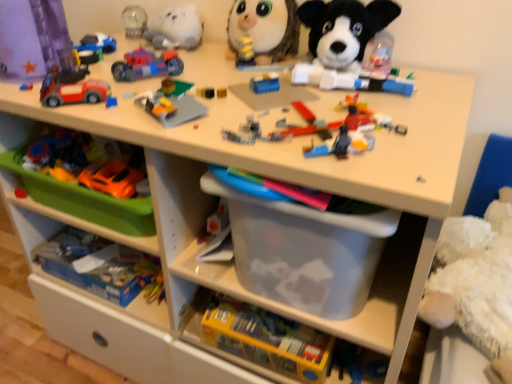
Locate an element on the screen. The width and height of the screenshot is (512, 384). translucent plastic bricks at center, which is counted as the fourth toy, starting from the bottom is located at coordinates (323, 123).

In order to click on orange matte car at left, which appears as the 3th toy when ordered from the bottom in this screenshot , I will do `click(111, 178)`.

Where is `matte plastic toy car at upper left, the eighth toy when ordered from bottom to top`? The width and height of the screenshot is (512, 384). matte plastic toy car at upper left, the eighth toy when ordered from bottom to top is located at coordinates (95, 47).

What do you see at coordinates (95, 47) in the screenshot? This screenshot has height=384, width=512. I see `matte plastic toy car at upper left, the second toy from the top` at bounding box center [95, 47].

The height and width of the screenshot is (384, 512). Describe the element at coordinates (295, 138) in the screenshot. I see `transparent plastic storage bin at center` at that location.

What are the coordinates of `transparent plastic storage bin at center` in the screenshot? It's located at (295, 138).

Locate an element on the screen. Image resolution: width=512 pixels, height=384 pixels. translucent plastic bricks at center, arranged as the 6th toy when viewed from the top is located at coordinates (323, 123).

Is yellow striped plush at upper center, marked as the first toy in a top-to-bottom arrangement, wider or thinner than translucent plastic container at lower center, which ranks as the 1th toy in bottom-to-top order?

In the image, yellow striped plush at upper center, marked as the first toy in a top-to-bottom arrangement, appears to be more narrow than translucent plastic container at lower center, which ranks as the 1th toy in bottom-to-top order.

Which is farther, (294, 35) or (196, 319)?

The point (294, 35) is behind.

The width and height of the screenshot is (512, 384). What are the coordinates of `the 8th toy above the translucent plastic container at lower center, positioned as the ninth toy in top-to-bottom order (from the image's perspective)` in the screenshot? It's located at click(x=264, y=29).

Considering the positions of objects yellow striped plush at upper center, marked as the first toy in a top-to-bottom arrangement, and translucent plastic container at lower center, positioned as the ninth toy in top-to-bottom order, in the image provided, who is in front, yellow striped plush at upper center, marked as the first toy in a top-to-bottom arrangement, or translucent plastic container at lower center, positioned as the ninth toy in top-to-bottom order,?

translucent plastic container at lower center, positioned as the ninth toy in top-to-bottom order.

This screenshot has height=384, width=512. In order to click on the 5th toy positioned above the transparent plastic storage bin at center (from the image's perspective) in this screenshot , I will do `click(344, 42)`.

Is transparent plastic storage bin at center positioned with its back to soft plush dog at upper center, which is the 3th toy in top-to-bottom order?

transparent plastic storage bin at center does not have its back to soft plush dog at upper center, which is the 3th toy in top-to-bottom order.

Is transparent plastic storage bin at center far from soft plush dog at upper center, which is the seventh toy from bottom to top?

transparent plastic storage bin at center is actually quite close to soft plush dog at upper center, which is the seventh toy from bottom to top.

Considering the positions of points (116, 94) and (325, 35), is point (116, 94) farther from camera compared to point (325, 35)?

No, (116, 94) is closer to viewer.

You are a GUI agent. You are given a task and a screenshot of the screen. Output one action in this format:
    pyautogui.click(x=<x>, y=<y>)
    Task: Click on the changing table below the matte plastic car at upper left, positioned as the 5th toy in bottom-to-top order (from the image's perspective)
    
    Given the screenshot: What is the action you would take?
    pyautogui.click(x=295, y=138)

In the image, is matte plastic car at upper left, positioned as the 5th toy in bottom-to-top order, positioned in front of or behind transparent plastic storage bin at center?

In the image, matte plastic car at upper left, positioned as the 5th toy in bottom-to-top order, appears behind transparent plastic storage bin at center.

Is matte plastic car at upper left, which is the fifth toy from top to bottom, far away from transparent plastic storage bin at center?

No, matte plastic car at upper left, which is the fifth toy from top to bottom, is not far away from transparent plastic storage bin at center.

Considering the sizes of matte plastic car at upper left, positioned as the 5th toy in bottom-to-top order, and transparent plastic storage bin at center in the image, is matte plastic car at upper left, positioned as the 5th toy in bottom-to-top order, taller or shorter than transparent plastic storage bin at center?

Considering their sizes, matte plastic car at upper left, positioned as the 5th toy in bottom-to-top order, has less height than transparent plastic storage bin at center.

Is translucent plastic motorcycle at upper center, placed as the fourth toy when sorted from top to bottom, not close to translucent plastic bricks at center, which is counted as the fourth toy, starting from the bottom?

No, translucent plastic motorcycle at upper center, placed as the fourth toy when sorted from top to bottom, is not far away from translucent plastic bricks at center, which is counted as the fourth toy, starting from the bottom.

Which of these two, translucent plastic motorcycle at upper center, placed as the fourth toy when sorted from top to bottom, or translucent plastic bricks at center, arranged as the 6th toy when viewed from the top, is wider?

With larger width is translucent plastic bricks at center, arranged as the 6th toy when viewed from the top.

In the scene shown: Is translucent plastic motorcycle at upper center, which ranks as the 6th toy in bottom-to-top order, aimed at translucent plastic bricks at center, which is counted as the fourth toy, starting from the bottom?

No, translucent plastic motorcycle at upper center, which ranks as the 6th toy in bottom-to-top order, is not oriented towards translucent plastic bricks at center, which is counted as the fourth toy, starting from the bottom.

Which of these two, translucent plastic motorcycle at upper center, placed as the fourth toy when sorted from top to bottom, or translucent plastic bricks at center, which is counted as the fourth toy, starting from the bottom, is bigger?

Bigger between the two is translucent plastic bricks at center, which is counted as the fourth toy, starting from the bottom.

From the picture: Relative to translucent plastic motorcycle at upper center, which ranks as the 6th toy in bottom-to-top order, is translucent plastic bricks at center, which is counted as the fourth toy, starting from the bottom, in front or behind?

Clearly, translucent plastic bricks at center, which is counted as the fourth toy, starting from the bottom, is in front of translucent plastic motorcycle at upper center, which ranks as the 6th toy in bottom-to-top order.

Considering the sizes of objects translucent plastic bricks at center, which is counted as the fourth toy, starting from the bottom, and translucent plastic motorcycle at upper center, which ranks as the 6th toy in bottom-to-top order, in the image provided, who is wider, translucent plastic bricks at center, which is counted as the fourth toy, starting from the bottom, or translucent plastic motorcycle at upper center, which ranks as the 6th toy in bottom-to-top order,?

translucent plastic bricks at center, which is counted as the fourth toy, starting from the bottom.

Based on the photo, would you say translucent plastic bricks at center, arranged as the 6th toy when viewed from the top, is inside or outside translucent plastic motorcycle at upper center, placed as the fourth toy when sorted from top to bottom?

translucent plastic bricks at center, arranged as the 6th toy when viewed from the top, is not enclosed by translucent plastic motorcycle at upper center, placed as the fourth toy when sorted from top to bottom.

From the image's perspective, is translucent plastic bricks at center, which is counted as the fourth toy, starting from the bottom, under translucent plastic motorcycle at upper center, placed as the fourth toy when sorted from top to bottom?

Indeed, from the image's perspective, translucent plastic bricks at center, which is counted as the fourth toy, starting from the bottom, is shown beneath translucent plastic motorcycle at upper center, placed as the fourth toy when sorted from top to bottom.

Visually, is blue cardboard box at lower left, arranged as the 2th toy when ordered from the bottom, positioned to the left or to the right of transparent plastic storage box at center?

From the image, it's evident that blue cardboard box at lower left, arranged as the 2th toy when ordered from the bottom, is to the left of transparent plastic storage box at center.

Does point (85, 263) appear closer or farther from the camera than point (292, 223)?

Point (85, 263).

From the transparent plastic storage box at center, count 7th toys backward and point to it. Please provide its 2D coordinates.

[(101, 266)]

In the scene shown: From a real-world perspective, which is physically below, blue cardboard box at lower left, marked as the 8th toy in a top-to-bottom arrangement, or transparent plastic storage box at center?

blue cardboard box at lower left, marked as the 8th toy in a top-to-bottom arrangement.

What's the angular difference between transparent plastic storage bin at center and green plastic tray at lower left's facing directions?

The angular difference between transparent plastic storage bin at center and green plastic tray at lower left is 0.459 degrees.

Is transparent plastic storage bin at center in front of or behind green plastic tray at lower left in the image?

In the image, transparent plastic storage bin at center appears in front of green plastic tray at lower left.

From the image's perspective, is transparent plastic storage bin at center below green plastic tray at lower left?

Yes, from the image's perspective, transparent plastic storage bin at center is below green plastic tray at lower left.

You are a GUI agent. You are given a task and a screenshot of the screen. Output one action in this format:
    pyautogui.click(x=<x>, y=<y>)
    Task: Click on the toy that is the 1st object to the left of the translucent plastic container at lower center, positioned as the ninth toy in top-to-bottom order, starting at the anchor
    The height and width of the screenshot is (384, 512).
    Given the screenshot: What is the action you would take?
    pyautogui.click(x=264, y=29)

The width and height of the screenshot is (512, 384). What are the coordinates of `changing table below the soft plush dog at upper center, which is the seventh toy from bottom to top (from the image's perspective)` in the screenshot? It's located at (295, 138).

Which object lies nearer to the anchor point translucent plastic bricks at center, arranged as the 6th toy when viewed from the top, translucent plastic container at lower center, positioned as the ninth toy in top-to-bottom order, or matte plastic toy car at upper left, the eighth toy when ordered from bottom to top?

translucent plastic container at lower center, positioned as the ninth toy in top-to-bottom order.

Looking at the image, which one is located closer to orange matte car at left, acting as the seventh toy starting from the top, soft plush dog at upper center, which is the 3th toy in top-to-bottom order, or matte plastic toy car at upper left, the eighth toy when ordered from bottom to top?

matte plastic toy car at upper left, the eighth toy when ordered from bottom to top, is positioned closer to the anchor orange matte car at left, acting as the seventh toy starting from the top.

Looking at the image, which one is located closer to transparent plastic storage box at center, translucent plastic bricks at center, which is counted as the fourth toy, starting from the bottom, or green plastic tray at lower left?

translucent plastic bricks at center, which is counted as the fourth toy, starting from the bottom, is positioned closer to the anchor transparent plastic storage box at center.

Based on their spatial positions, is matte plastic toy car at upper left, the eighth toy when ordered from bottom to top, or translucent plastic motorcycle at upper center, placed as the fourth toy when sorted from top to bottom, further from matte plastic car at upper left, which is the fifth toy from top to bottom?

matte plastic toy car at upper left, the eighth toy when ordered from bottom to top, is positioned further to the anchor matte plastic car at upper left, which is the fifth toy from top to bottom.

Which object lies further to the anchor point translucent plastic bricks at center, arranged as the 6th toy when viewed from the top, yellow striped plush at upper center, marked as the first toy in a top-to-bottom arrangement, or blue cardboard box at lower left, arranged as the 2th toy when ordered from the bottom?

blue cardboard box at lower left, arranged as the 2th toy when ordered from the bottom.

Which object lies nearer to the anchor point translucent plastic container at lower center, which ranks as the 1th toy in bottom-to-top order, green plastic tray at lower left or translucent plastic bricks at center, which is counted as the fourth toy, starting from the bottom?

The object closer to translucent plastic container at lower center, which ranks as the 1th toy in bottom-to-top order, is green plastic tray at lower left.

Which object lies nearer to the anchor point matte plastic toy car at upper left, the second toy from the top, green plastic tray at lower left or transparent plastic storage bin at center?

The object closer to matte plastic toy car at upper left, the second toy from the top, is green plastic tray at lower left.

From the image, which object appears to be nearer to soft plush dog at upper center, which is the seventh toy from bottom to top, green plastic tray at lower left or transparent plastic storage box at center?

Among the two, transparent plastic storage box at center is located nearer to soft plush dog at upper center, which is the seventh toy from bottom to top.

Find the location of a particular element. The height and width of the screenshot is (384, 512). storage box between blue cardboard box at lower left, marked as the 8th toy in a top-to-bottom arrangement, and translucent plastic bricks at center, arranged as the 6th toy when viewed from the top, from left to right is located at coordinates (304, 251).

Locate an element on the screen. This screenshot has height=384, width=512. storage box that lies between soft plush dog at upper center, which is the 3th toy in top-to-bottom order, and translucent plastic container at lower center, which ranks as the 1th toy in bottom-to-top order, from top to bottom is located at coordinates (304, 251).

In order to click on shelf between matte plastic car at upper left, positioned as the 5th toy in bottom-to-top order, and blue cardboard box at lower left, arranged as the 2th toy when ordered from the bottom, vertically in this screenshot , I will do `click(79, 221)`.

You are a GUI agent. You are given a task and a screenshot of the screen. Output one action in this format:
    pyautogui.click(x=<x>, y=<y>)
    Task: Click on the storage box between transparent plastic storage bin at center and matte plastic toy car at upper left, the second toy from the top, along the z-axis
    
    Given the screenshot: What is the action you would take?
    pyautogui.click(x=304, y=251)